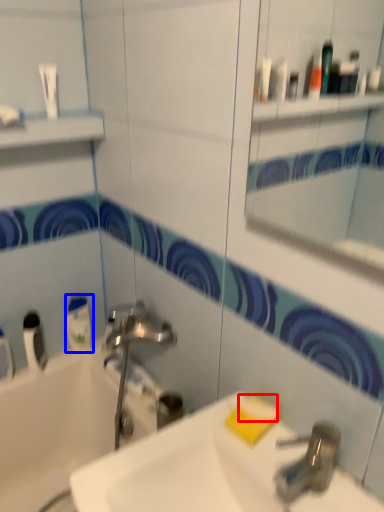
Question: Which of the following is the closest to the observer, soap (highlighted by a red box) or mouthwash (highlighted by a blue box)?

Choices:
 (A) soap
 (B) mouthwash

Answer: (A)